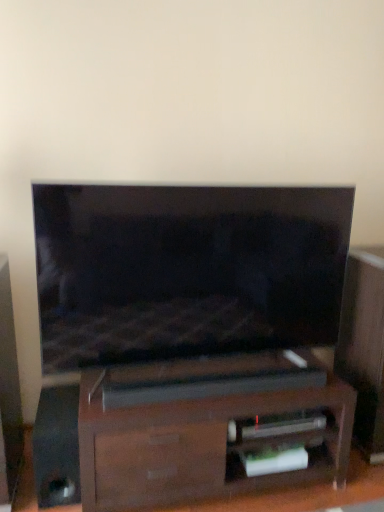
Question: Is dark wood soundbar at center to the left of matte black tv at center from the viewer's perspective?

Choices:
 (A) yes
 (B) no

Answer: (B)

Question: Is dark wood soundbar at center oriented away from matte black tv at center?

Choices:
 (A) no
 (B) yes

Answer: (A)

Question: Does dark wood soundbar at center have a lesser width compared to matte black tv at center?

Choices:
 (A) no
 (B) yes

Answer: (A)

Question: Can you confirm if dark wood soundbar at center is shorter than matte black tv at center?

Choices:
 (A) no
 (B) yes

Answer: (B)

Question: Is dark wood soundbar at center in front of matte black tv at center?

Choices:
 (A) no
 (B) yes

Answer: (A)

Question: Considering the positions of matte black tv at center and dark wood soundbar at center in the image, is matte black tv at center bigger or smaller than dark wood soundbar at center?

Choices:
 (A) small
 (B) big

Answer: (A)

Question: Is matte black tv at center taller or shorter than dark wood soundbar at center?

Choices:
 (A) short
 (B) tall

Answer: (B)

Question: In the image, is matte black tv at center positioned in front of or behind dark wood soundbar at center?

Choices:
 (A) front
 (B) behind

Answer: (A)

Question: Considering the positions of point (279, 289) and point (104, 445), is point (279, 289) closer or farther from the camera than point (104, 445)?

Choices:
 (A) closer
 (B) farther

Answer: (B)

Question: Is point (51, 501) positioned closer to the camera than point (182, 219)?

Choices:
 (A) closer
 (B) farther

Answer: (B)

Question: Is black glossy speaker at lower left spatially inside matte black tv at center, or outside of it?

Choices:
 (A) outside
 (B) inside

Answer: (A)

Question: Is black glossy speaker at lower left taller or shorter than matte black tv at center?

Choices:
 (A) short
 (B) tall

Answer: (A)

Question: From the image's perspective, is black glossy speaker at lower left above or below matte black tv at center?

Choices:
 (A) above
 (B) below

Answer: (B)

Question: Is black glossy speaker at lower left wider or thinner than dark wood soundbar at center?

Choices:
 (A) thin
 (B) wide

Answer: (A)

Question: Considering the positions of black glossy speaker at lower left and dark wood soundbar at center in the image, is black glossy speaker at lower left taller or shorter than dark wood soundbar at center?

Choices:
 (A) tall
 (B) short

Answer: (B)